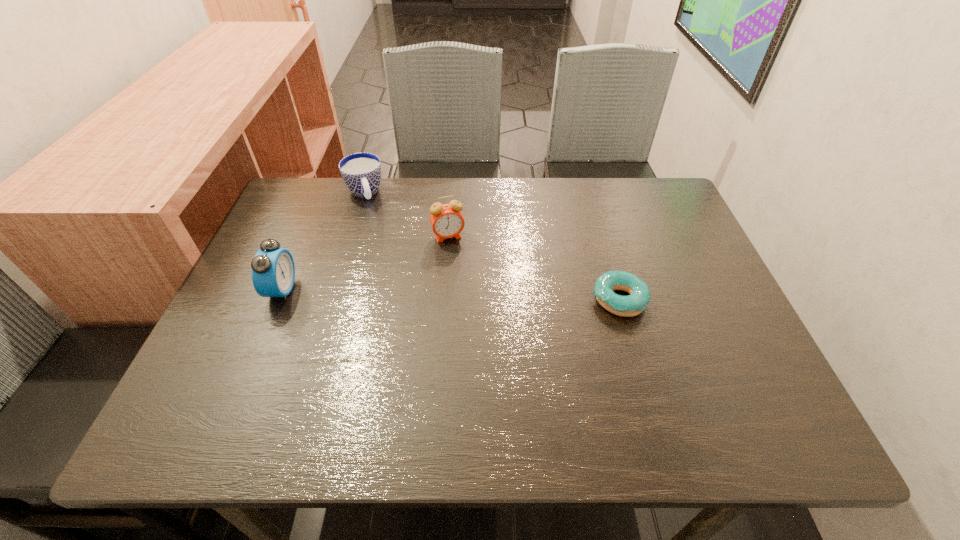
What are the coordinates of `free spot located on the face of the third object from left to right` in the screenshot? It's located at (462, 273).

Where is `vacant area situated on the face of the third object from left to right`? This screenshot has height=540, width=960. vacant area situated on the face of the third object from left to right is located at coordinates (471, 300).

Where is `vacant space located 0.260m on the face of the third object from left to right`? This screenshot has width=960, height=540. vacant space located 0.260m on the face of the third object from left to right is located at coordinates (478, 320).

The width and height of the screenshot is (960, 540). I want to click on vacant region located 0.090m on the side of the third object from right to left with the handle, so click(373, 226).

I want to click on free space located 0.310m on the side of the third object from right to left with the handle, so (x=393, y=281).

At what (x,y) coordinates should I click in order to perform the action: click on vacant space located 0.240m on the side of the third object from right to left with the handle. Please return your answer as a coordinate pair (x, y). Looking at the image, I should click on (386, 262).

Find the location of a particular element. The height and width of the screenshot is (540, 960). alarm clock present at the far edge is located at coordinates (447, 221).

Where is `cup at the far edge`? This screenshot has width=960, height=540. cup at the far edge is located at coordinates (361, 172).

At what (x,y) coordinates should I click in order to perform the action: click on alarm clock at the left edge. Please return your answer as a coordinate pair (x, y). The height and width of the screenshot is (540, 960). Looking at the image, I should click on (273, 270).

Find the location of a particular element. cup present at the left edge is located at coordinates (361, 172).